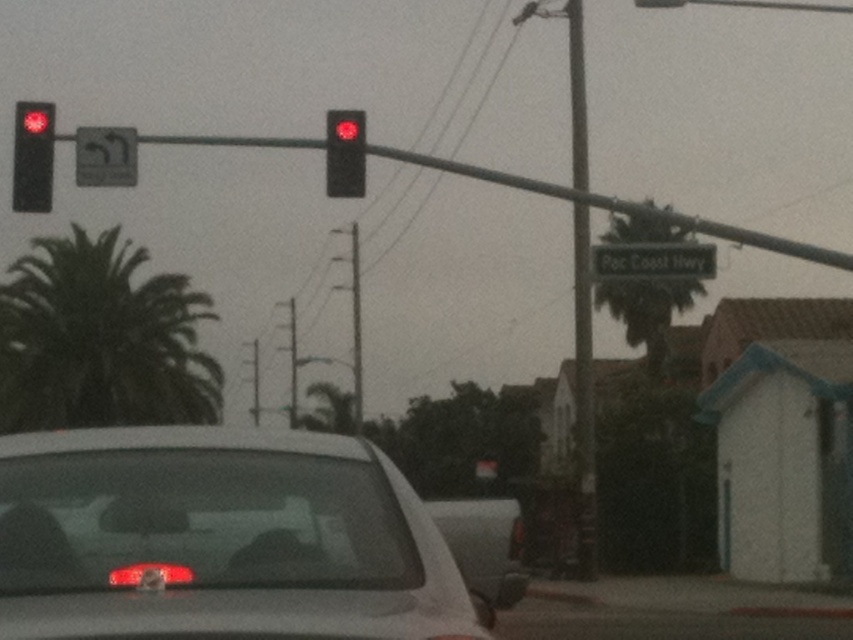
Does metallic pole at center-right come in front of matte red traffic light at center?

Yes, it is in front of matte red traffic light at center.

Is metallic pole at center-right smaller than matte red traffic light at center?

No, metallic pole at center-right is not smaller than matte red traffic light at center.

Between point (573, 156) and point (357, 120), which one is positioned in front?

Point (357, 120)

Locate an element on the screen. The height and width of the screenshot is (640, 853). metallic pole at center-right is located at coordinates (581, 298).

Does metallic pole at center-right appear on the right side of matte black traffic light at center?

Correct, you'll find metallic pole at center-right to the right of matte black traffic light at center.

Measure the distance between point (543, 13) and camera.

A distance of 134.36 feet exists between point (543, 13) and camera.

I want to click on metallic pole at center-right, so click(581, 298).

Based on the photo, does matte black traffic light at center appear on the right side of matte red traffic light at center?

No, matte black traffic light at center is not to the right of matte red traffic light at center.

Is matte black traffic light at center above matte red traffic light at center?

Indeed, matte black traffic light at center is positioned over matte red traffic light at center.

Is point (349, 192) closer to camera compared to point (350, 125)?

No, (349, 192) is behind (350, 125).

Locate an element on the screen. The image size is (853, 640). matte black traffic light at center is located at coordinates (345, 154).